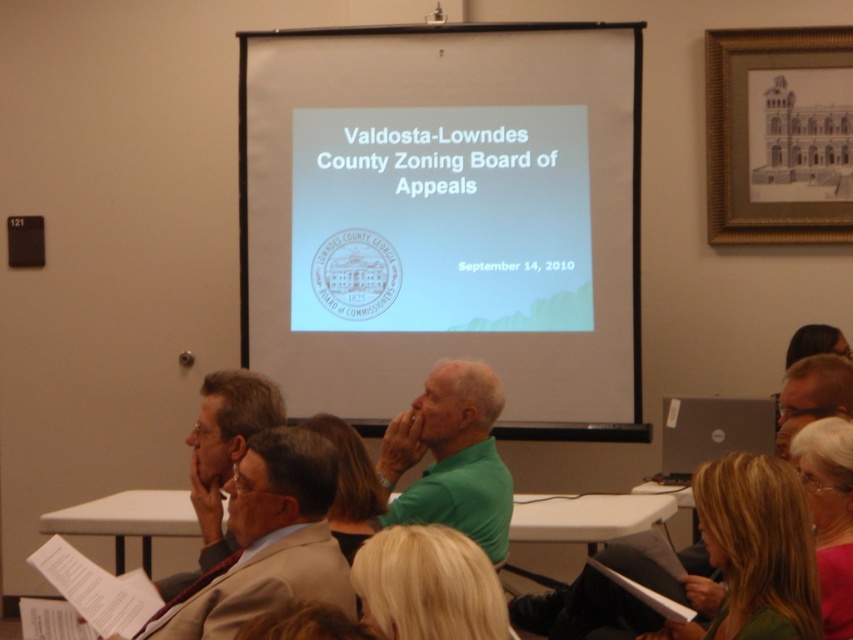
Question: Can you confirm if white matte projection screen at center is bigger than blonde hair at center?

Choices:
 (A) yes
 (B) no

Answer: (A)

Question: Estimate the real-world distances between objects in this image. Which object is closer to the green matte shirt at center?

Choices:
 (A) green matte shirt at lower right
 (B) light brown suit at center

Answer: (B)

Question: Which object is the closest to the white matte projection screen at center?

Choices:
 (A) light brown suit at center
 (B) green matte shirt at lower right
 (C) blonde hair at center
 (D) pink fabric at lower right

Answer: (D)

Question: Which object appears closest to the camera in this image?

Choices:
 (A) green matte shirt at lower right
 (B) blonde hair at center
 (C) light brown suit at center

Answer: (B)

Question: Can you confirm if green matte shirt at lower right is positioned below pink fabric at lower right?

Choices:
 (A) no
 (B) yes

Answer: (B)

Question: Is gold-framed drawing at upper right to the left of pink fabric at lower right from the viewer's perspective?

Choices:
 (A) no
 (B) yes

Answer: (A)